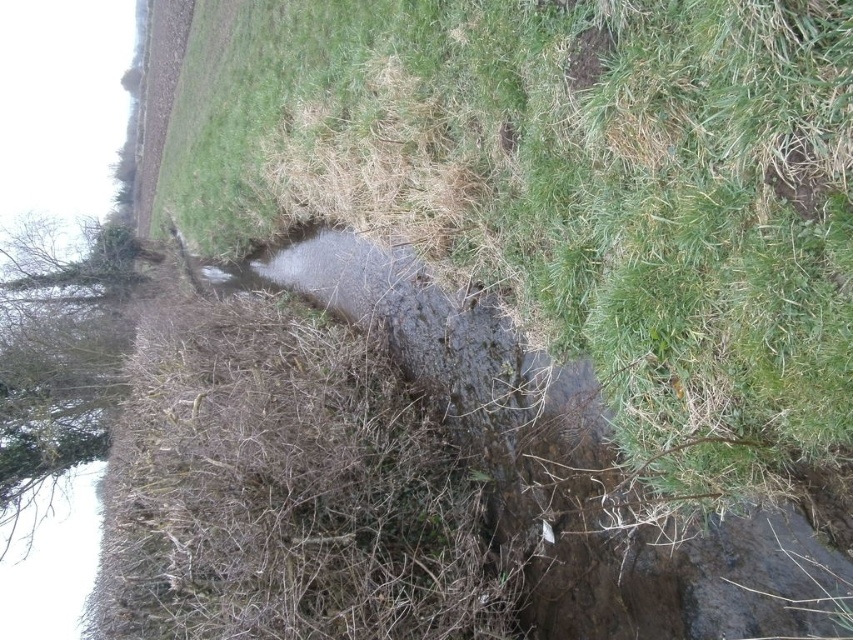
Question: Is green grassy at center bigger than green leafy tree at left?

Choices:
 (A) yes
 (B) no

Answer: (A)

Question: Which object is farther from the camera taking this photo?

Choices:
 (A) green leafy tree at left
 (B) green grassy at center

Answer: (A)

Question: Is green grassy at center in front of green leafy tree at left?

Choices:
 (A) no
 (B) yes

Answer: (B)

Question: Can you confirm if green grassy at center is smaller than green leafy tree at left?

Choices:
 (A) no
 (B) yes

Answer: (A)

Question: Which object is closer to the camera taking this photo?

Choices:
 (A) green grassy at center
 (B) green leafy tree at left

Answer: (A)